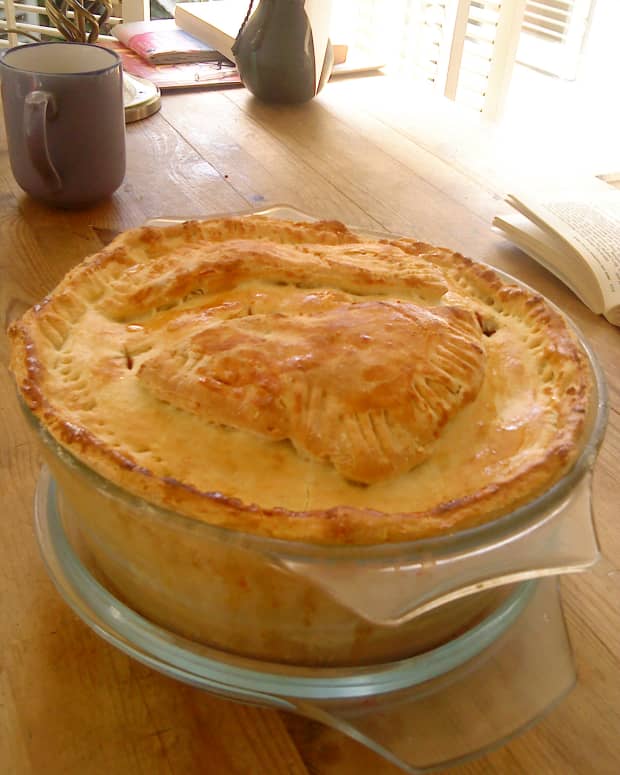
This screenshot has height=775, width=620. I want to click on book, so (596, 276).